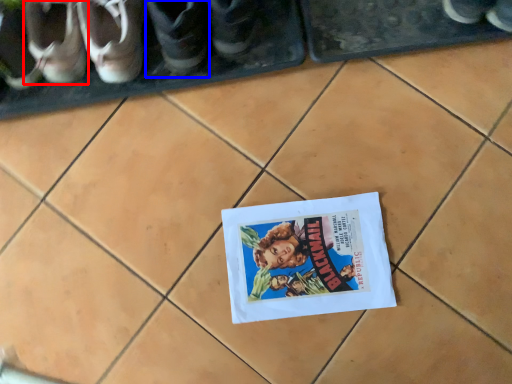
Question: Among these objects, which one is nearest to the camera, footwear (highlighted by a red box) or footwear (highlighted by a blue box)?

Choices:
 (A) footwear
 (B) footwear

Answer: (B)